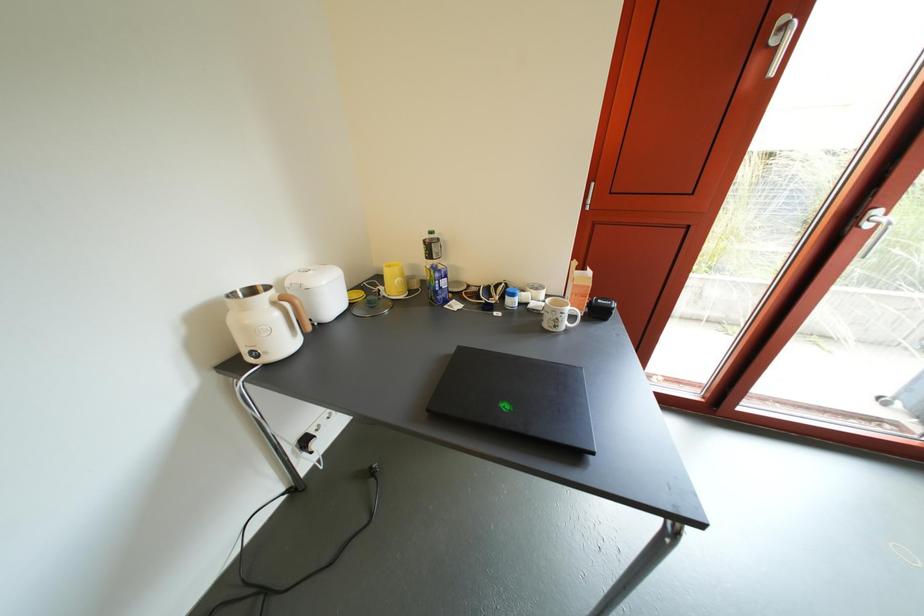
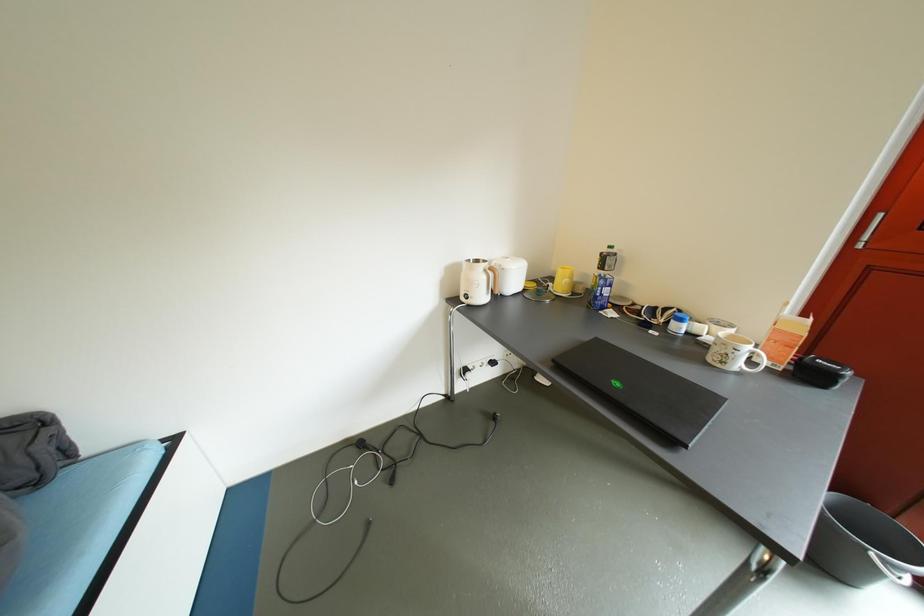
Question: The camera is either moving clockwise (left) or counter-clockwise (right) around the object. The first image is from the beginning of the video and the second image is from the end. Is the camera moving left or right when shooting the video?

Choices:
 (A) Left
 (B) Right

Answer: (B)